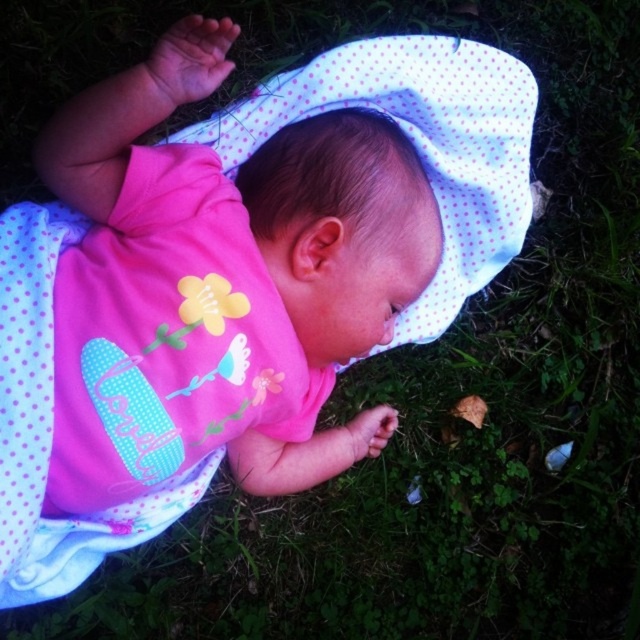
Is pink matte fabric baby at center above white dotted fabric at center?

No, pink matte fabric baby at center is not above white dotted fabric at center.

Between pink matte fabric baby at center and white dotted fabric at center, which one appears on the left side from the viewer's perspective?

pink matte fabric baby at center is more to the left.

Is point (305, 323) farther from viewer compared to point (394, 65)?

That is False.

You are a GUI agent. You are given a task and a screenshot of the screen. Output one action in this format:
    pyautogui.click(x=<x>, y=<y>)
    Task: Click on the pink matte fabric baby at center
    This screenshot has height=640, width=640.
    Given the screenshot: What is the action you would take?
    pyautogui.click(x=348, y=259)